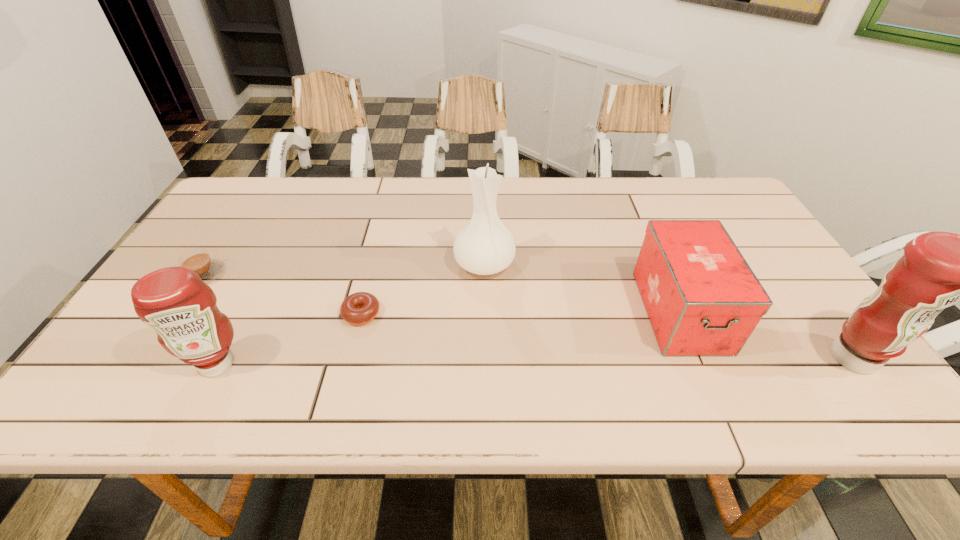
This screenshot has width=960, height=540. Find the location of `vacant space at the far edge of the desktop`. vacant space at the far edge of the desktop is located at coordinates (591, 204).

The height and width of the screenshot is (540, 960). I want to click on blank space at the near edge of the desktop, so click(514, 352).

Where is `vacant space at the left edge`? vacant space at the left edge is located at coordinates (248, 224).

Image resolution: width=960 pixels, height=540 pixels. I want to click on vacant area that lies between the shortest object and the cappuccino, so click(282, 294).

Identify the location of empty location between the leftmost object and the rightmost object. (528, 316).

Identify the location of vacant area that lies between the fifth object from right to left and the second object from right to left. This screenshot has height=540, width=960. point(448,338).

Image resolution: width=960 pixels, height=540 pixels. I want to click on vacant space that is in between the second object from right to left and the second shortest object, so click(442, 293).

Where is `free space between the cappuccino and the fourth object from right to left`? The image size is (960, 540). free space between the cappuccino and the fourth object from right to left is located at coordinates (282, 294).

This screenshot has width=960, height=540. I want to click on vacant space that's between the third shortest object and the leftmost object, so click(x=442, y=293).

Find the location of a particular element. The image size is (960, 540). vacant space in between the taller condiment and the leftmost object is located at coordinates (528, 316).